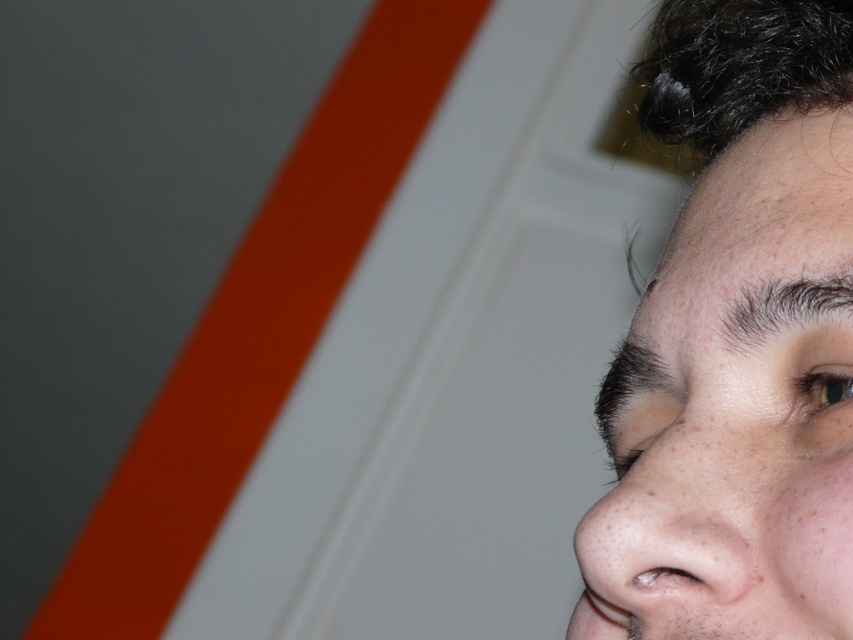
Question: Does dark brown curly hair at upper right appear on the left side of dark brown hair at upper right?

Choices:
 (A) no
 (B) yes

Answer: (B)

Question: Which of the following is the farthest from the observer?

Choices:
 (A) smooth skin face at upper right
 (B) dark brown curly hair at upper right

Answer: (B)

Question: Is smooth skin face at upper right bigger than dark brown curly hair at upper right?

Choices:
 (A) yes
 (B) no

Answer: (A)

Question: Based on their relative distances, which object is nearer to the smooth skin face at upper right?

Choices:
 (A) dark brown curly hair at upper right
 (B) dark brown hair at upper right

Answer: (B)

Question: Among these objects, which one is farthest from the camera?

Choices:
 (A) smooth skin face at upper right
 (B) dark brown hair at upper right

Answer: (B)

Question: Does smooth skin face at upper right appear on the right side of dark brown hair at upper right?

Choices:
 (A) yes
 (B) no

Answer: (B)